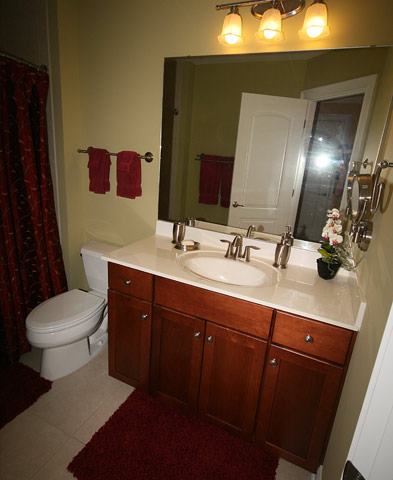
At what (x,y) coordinates should I click in order to perform the action: click on towel bar. Please return your answer as a coordinate pair (x, y). The image size is (393, 480). Looking at the image, I should click on (147, 156).